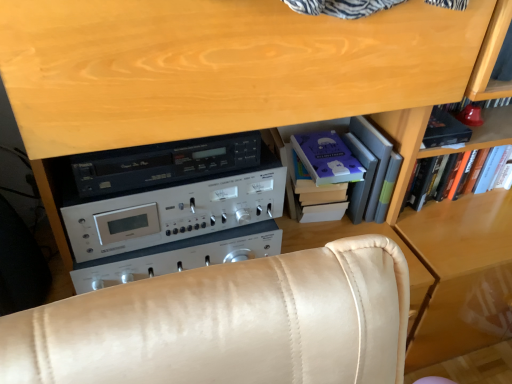
Locate an element on the screen. This screenshot has width=512, height=384. empty space that is ontop of purple matte paper at center, arranged as the first paperback book when viewed from the left is located at coordinates (332, 153).